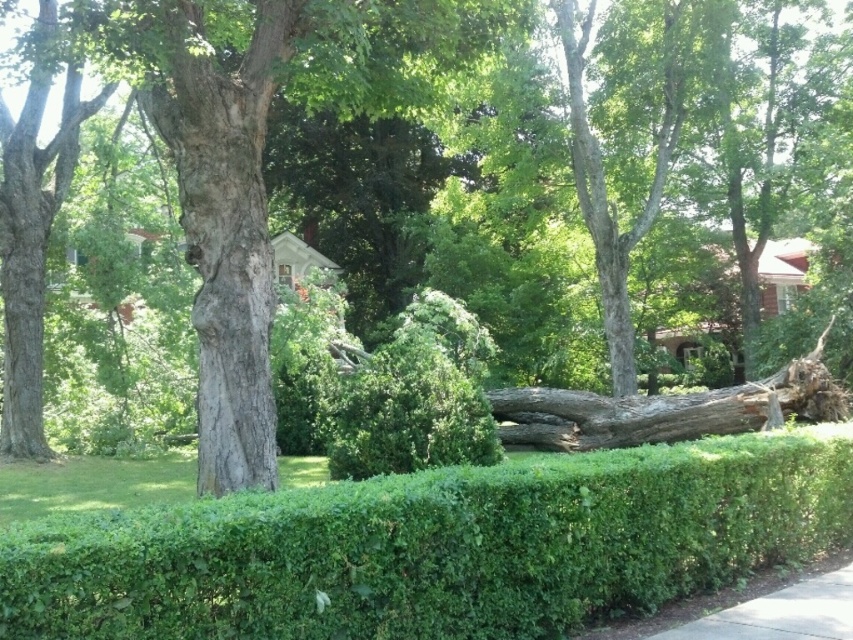
Question: Which point is farther to the camera?

Choices:
 (A) (764, 600)
 (B) (509, 625)

Answer: (A)

Question: Does green leafy hedge at center have a greater width compared to gray concrete sidewalk at lower right?

Choices:
 (A) no
 (B) yes

Answer: (B)

Question: Is green leafy hedge at center further to the viewer compared to gray concrete sidewalk at lower right?

Choices:
 (A) no
 (B) yes

Answer: (A)

Question: Can you confirm if green leafy hedge at center is positioned above gray concrete sidewalk at lower right?

Choices:
 (A) no
 (B) yes

Answer: (B)